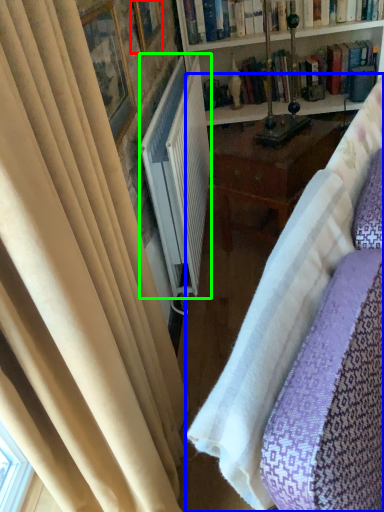
Question: Which object is positioned farthest from picture frame (highlighted by a red box)? Select from studio couch (highlighted by a blue box) and radiator (highlighted by a green box).

Choices:
 (A) studio couch
 (B) radiator

Answer: (A)